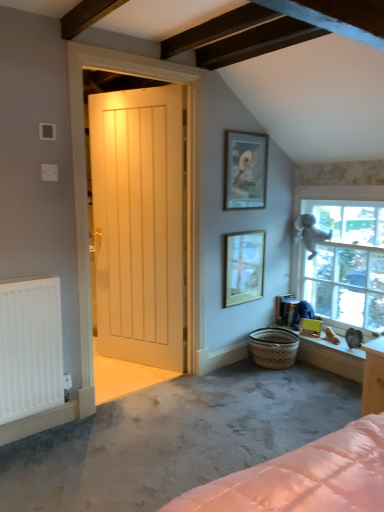
Find the location of a particular element. free space that is to the left of woven natural basket at lower right is located at coordinates 237,372.